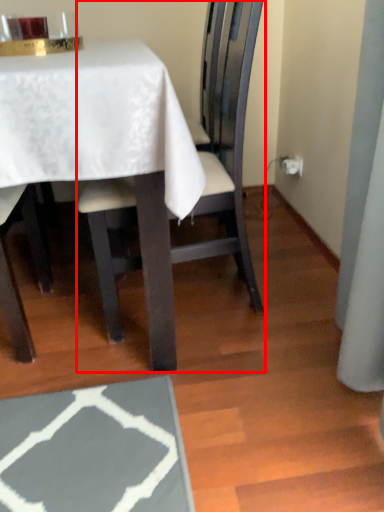
Question: From the image's perspective, considering the relative positions of chair (annotated by the red box) and table in the image provided, where is chair (annotated by the red box) located with respect to the staircase?

Choices:
 (A) above
 (B) below

Answer: (B)